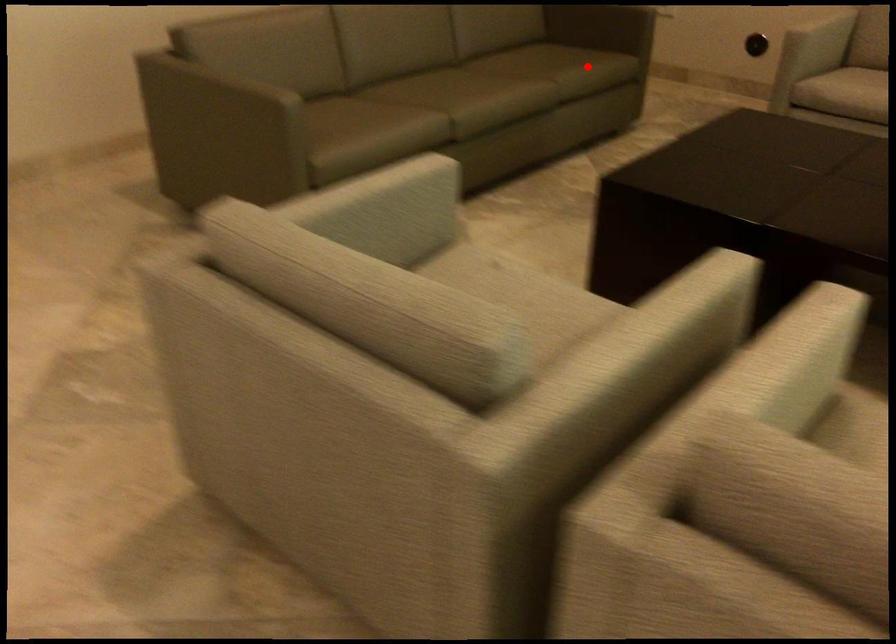
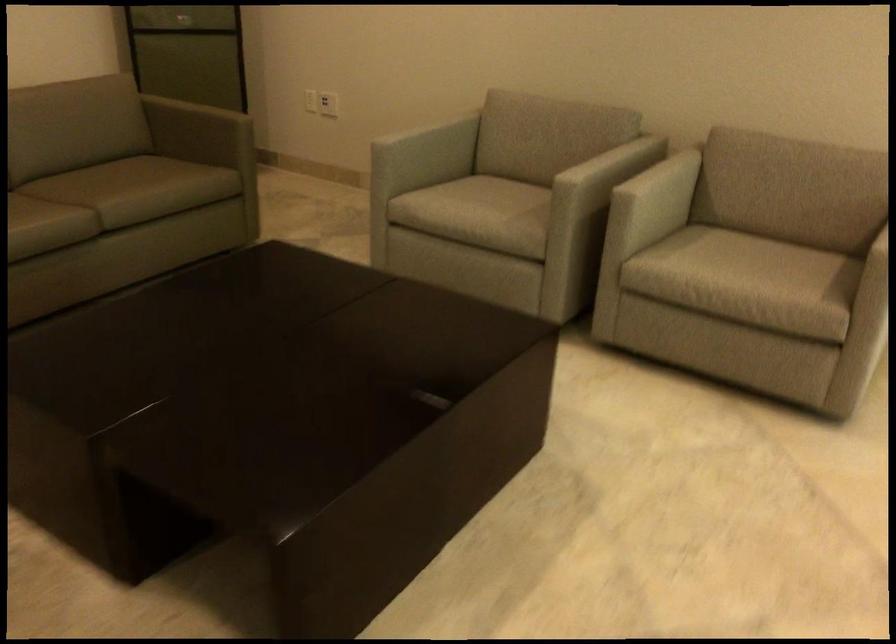
The point at the highlighted location is marked in the first image. Where is the corresponding point in the second image?

(145, 187)